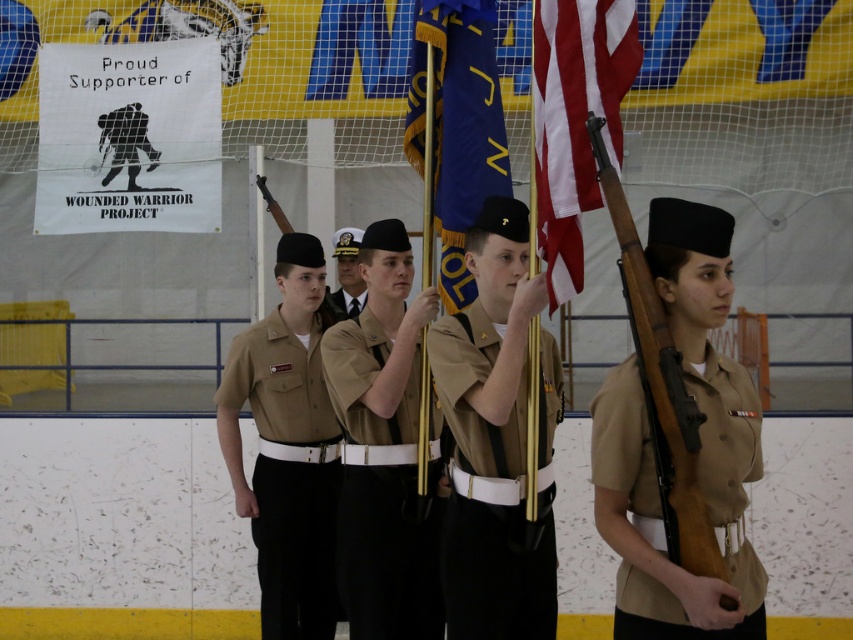
You are a photographer at the event and need to capture a photo where both the american flag at center and the satin black tie at center are visible. Based on their positions, which one should be framed first to ensure both are in the shot?

The american flag at center is located above the satin black tie at center, so you should frame the american flag at center first to ensure both are visible in the photo.

You are a photographer positioned at the back of the room. You want to take a photo that includes both the american flag at center and the satin black tie at center. The camera you are using has a maximum focus range of 5 meters. Can you capture both objects in focus without moving your position?

The american flag at center is 4.92 meters away from the satin black tie at center. Since the distance between them is within the camera maximum focus range of 5 meters, you can capture both objects in focus without moving your position.

You are organizing a military parade and need to ensure that the brown cotton uniform at center and the blue fabric flag at center can fit side by side on a 1.2 meter wide platform. Based on their sizes, will they fit together?

The brown cotton uniform at center is wider than the blue fabric flag at center. Since the total width of both items combined may exceed 1.2 meters, they might not fit together on the platform.